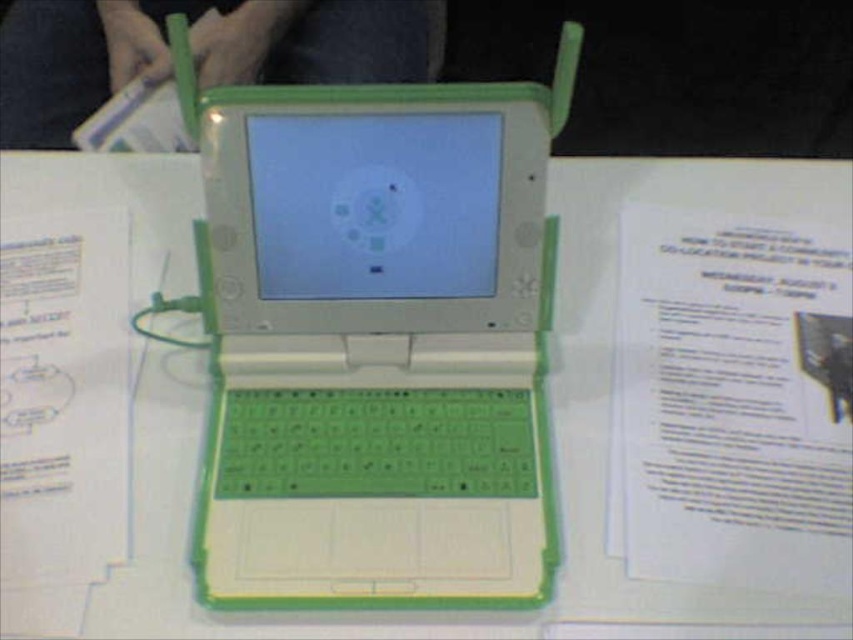
Consider the image. You are organizing a workspace and need to place a 18 cm wide notebook between the green plastic laptop at center and the white paper at upper right. Can you fit it there?

The distance between the green plastic laptop at center and the white paper at upper right is 17.52 centimeters, which is less than the 18 cm width of the notebook. Therefore, the notebook cannot fit in that space.

You are holding a camera and want to take a photo of the small green laptop displayed on the white surface. The camera is currently positioned at a point that is 19.77 inches away from the point marked as point (724, 470). Based on the scene description, can you determine if the camera is close enough to capture the entire laptop in the frame?

The camera is positioned 19.77 inches away from point (724, 470). Since the laptop is small and placed on a white surface, this distance should be sufficient to capture the entire laptop in the frame.

You are organizing a workspace and need to place a document on the white paper at upper right. To ensure the document is visible, should you move the green plastic laptop at center to the right or left?

The green plastic laptop at center is already to the left of the white paper at upper right. Moving it further to the left would give more space, making the document on the white paper at upper right more visible.